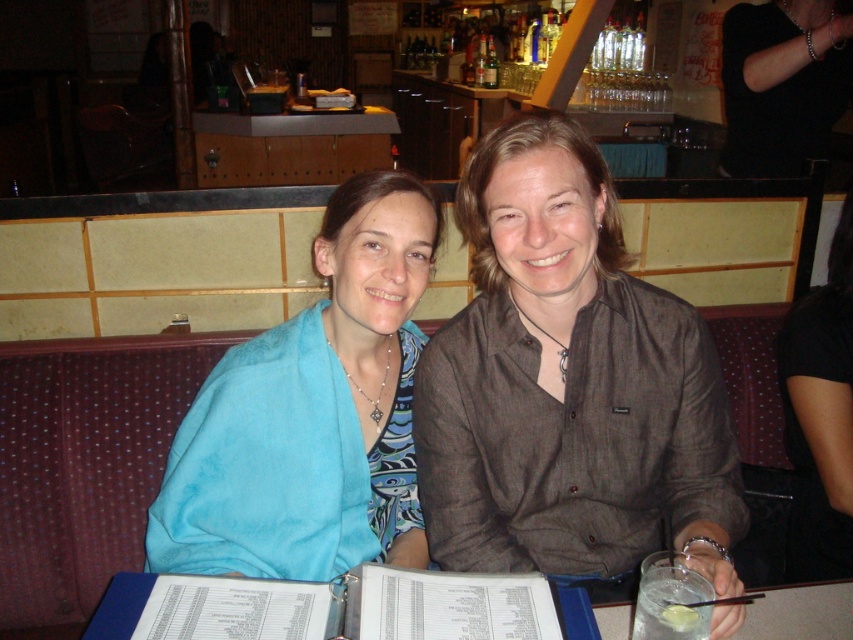
Question: Is blue fabric at center above black matte shirt at upper center?

Choices:
 (A) yes
 (B) no

Answer: (B)

Question: Estimate the real-world distances between objects in this image. Which object is farther from the clear glass at lower right?

Choices:
 (A) black matte shirt at upper center
 (B) black leather arm at upper right
 (C) brown textured shirt at center
 (D) white paper menu at center

Answer: (B)

Question: Does black matte shirt at upper center have a larger size compared to clear glass at lower right?

Choices:
 (A) yes
 (B) no

Answer: (A)

Question: Can you confirm if blue fabric at center is wider than black matte shirt at upper center?

Choices:
 (A) yes
 (B) no

Answer: (A)

Question: Which object is the closest to the black matte shirt at upper center?

Choices:
 (A) blue fabric at center
 (B) clear glass at lower right
 (C) brown textured shirt at center

Answer: (C)

Question: Which point appears farthest from the camera in this image?

Choices:
 (A) (538, 435)
 (B) (437, 612)
 (C) (167, 474)

Answer: (C)